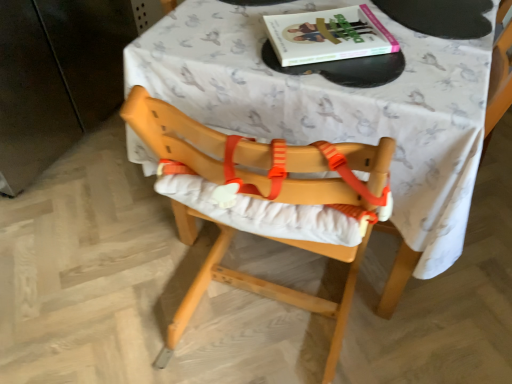
Where is `vacant space that is in between white fabric-covered table at center and natural wood highchair at center`? This screenshot has height=384, width=512. vacant space that is in between white fabric-covered table at center and natural wood highchair at center is located at coordinates (252, 323).